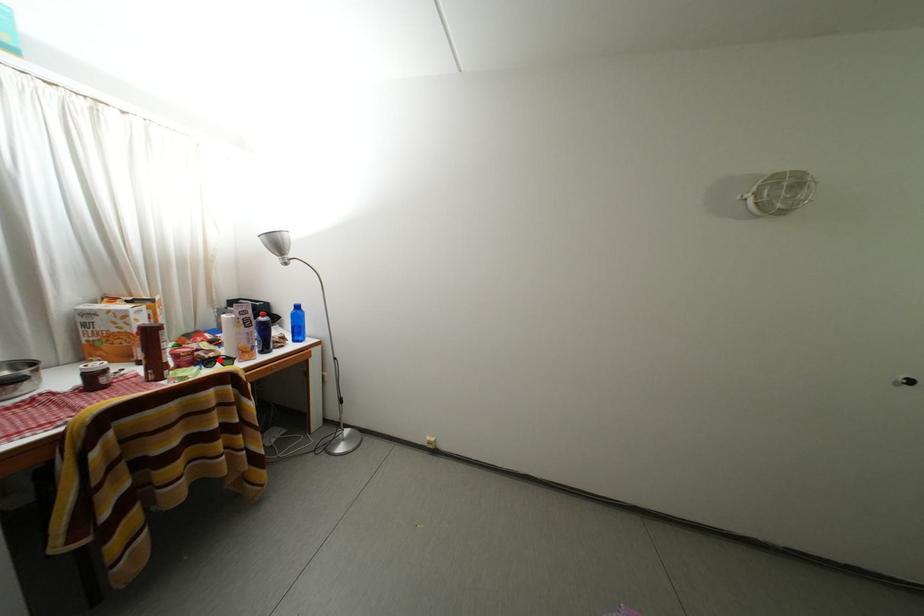
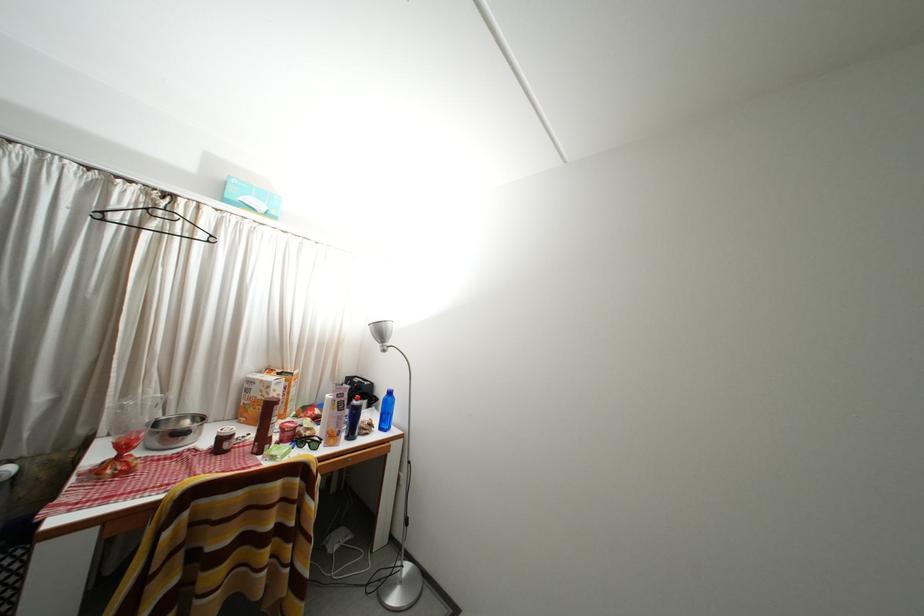
Question: I am providing you with two images of the same scene from different viewpoints. Image1 has a red point marked. In image2, the corresponding 3D location appears at what relative position? Reply with the corresponding letter.

Choices:
 (A) Closer
 (B) Farther

Answer: (B)